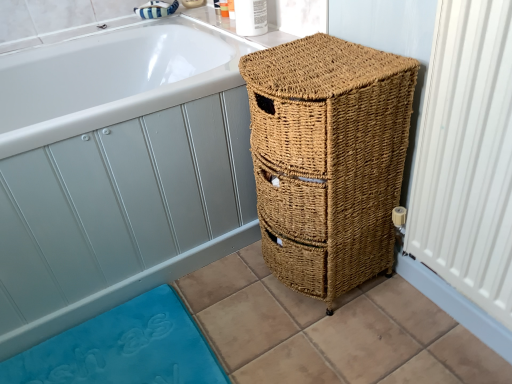
Question: Is white glossy bathtub at upper left at the right side of white textured radiator at right?

Choices:
 (A) yes
 (B) no

Answer: (B)

Question: Does white glossy bathtub at upper left have a lesser width compared to white textured radiator at right?

Choices:
 (A) no
 (B) yes

Answer: (A)

Question: Is white glossy bathtub at upper left oriented away from white textured radiator at right?

Choices:
 (A) no
 (B) yes

Answer: (A)

Question: Would you say white glossy bathtub at upper left contains white textured radiator at right?

Choices:
 (A) no
 (B) yes

Answer: (A)

Question: Does white glossy bathtub at upper left come in front of white textured radiator at right?

Choices:
 (A) no
 (B) yes

Answer: (A)

Question: Would you say woven brown basket at right is to the left or to the right of white textured radiator at right in the picture?

Choices:
 (A) right
 (B) left

Answer: (B)

Question: From a real-world perspective, relative to white textured radiator at right, is woven brown basket at right vertically above or below?

Choices:
 (A) below
 (B) above

Answer: (A)

Question: In terms of size, does woven brown basket at right appear bigger or smaller than white textured radiator at right?

Choices:
 (A) small
 (B) big

Answer: (B)

Question: From their relative heights in the image, would you say woven brown basket at right is taller or shorter than white textured radiator at right?

Choices:
 (A) tall
 (B) short

Answer: (B)

Question: From a real-world perspective, relative to white textured radiator at right, is blue rubber bath mat at lower left vertically above or below?

Choices:
 (A) above
 (B) below

Answer: (B)

Question: Looking at the image, does blue rubber bath mat at lower left seem bigger or smaller compared to white textured radiator at right?

Choices:
 (A) big
 (B) small

Answer: (B)

Question: In the image, is blue rubber bath mat at lower left positioned in front of or behind white textured radiator at right?

Choices:
 (A) front
 (B) behind

Answer: (B)

Question: Is point (80, 377) closer or farther from the camera than point (429, 240)?

Choices:
 (A) farther
 (B) closer

Answer: (A)

Question: Choose the correct answer: Is white glossy bathtub at upper left inside blue rubber bath mat at lower left or outside it?

Choices:
 (A) outside
 (B) inside

Answer: (A)

Question: From the image's perspective, relative to blue rubber bath mat at lower left, is white glossy bathtub at upper left above or below?

Choices:
 (A) below
 (B) above

Answer: (B)